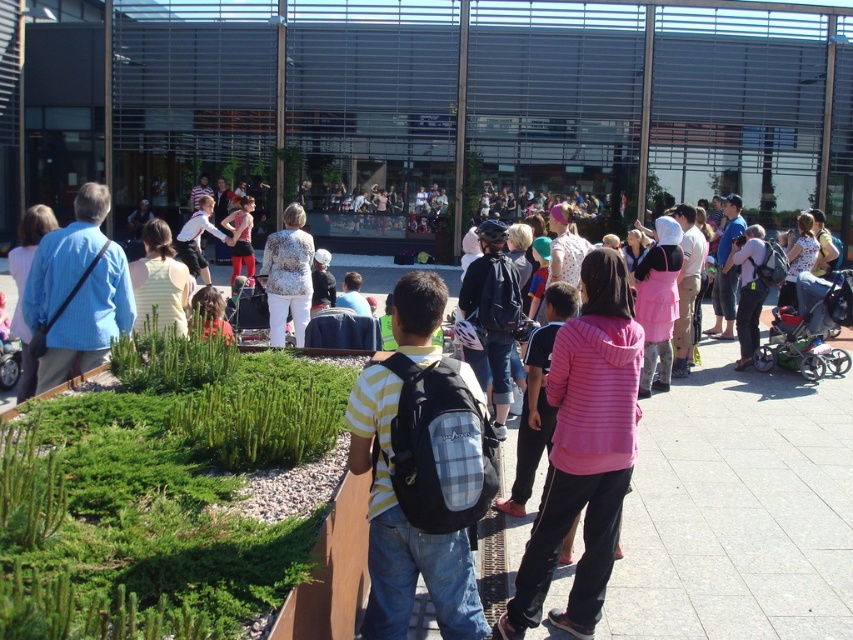
Image resolution: width=853 pixels, height=640 pixels. Find the location of `yellow and white striped shirt at center`. yellow and white striped shirt at center is located at coordinates (421, 470).

Is yellow and white striped shirt at center thinner than floral-patterned blouse at center?

Indeed, yellow and white striped shirt at center has a lesser width compared to floral-patterned blouse at center.

The height and width of the screenshot is (640, 853). Find the location of `yellow and white striped shirt at center`. yellow and white striped shirt at center is located at coordinates (421, 470).